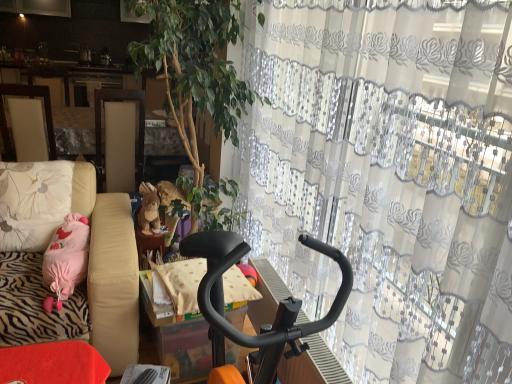
Question: From the image's perspective, is brown plush rabbit at center positioned above or below black textured cushion at center?

Choices:
 (A) below
 (B) above

Answer: (B)

Question: Is brown plush rabbit at center wider or thinner than black textured cushion at center?

Choices:
 (A) wide
 (B) thin

Answer: (B)

Question: Estimate the real-world distances between objects in this image. Which object is farther from the brown plush rabbit at center?

Choices:
 (A) black plastic exercise bike at center
 (B) pink fabric pillow at left
 (C) black textured cushion at center
 (D) green leafy plant at center
 (E) matte wood screen door at center

Answer: (A)

Question: Which of these objects is positioned farthest from the black plastic exercise bike at center?

Choices:
 (A) matte wood screen door at center
 (B) pink fabric pillow at left
 (C) green leafy plant at center
 (D) black textured cushion at center
 (E) brown plush rabbit at center

Answer: (A)